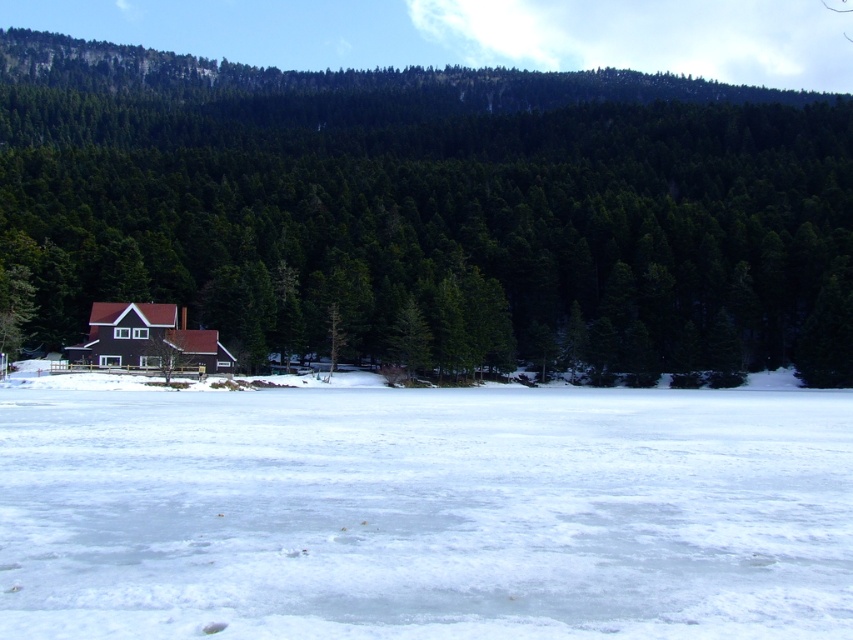
You are standing at the edge of the frozen lake and want to reach the small house with the red roof. According to the image, where is the white matte snow at center located in relation to your path towards the house?

The white matte snow at center is located at point (425, 513), which is along your path towards the house. You should be cautious of the snow as it may be covering the ice, affecting your footing.